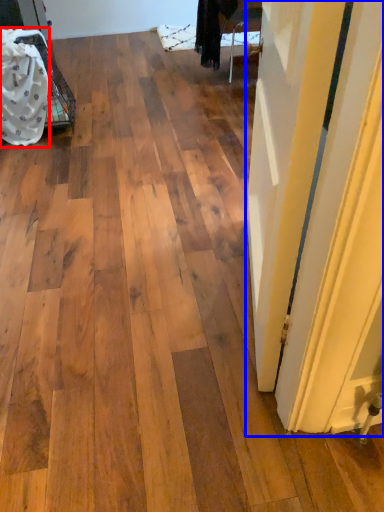
Question: Which object appears closest to the camera in this image, material (highlighted by a red box) or door (highlighted by a blue box)?

Choices:
 (A) material
 (B) door

Answer: (B)